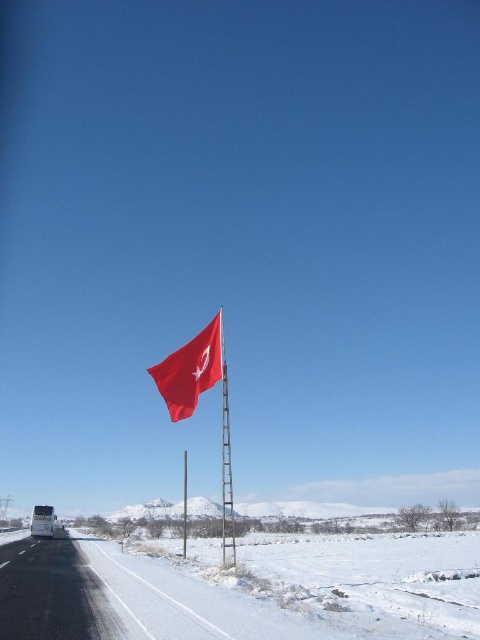
You are a driver approaching the intersection where the black asphalt highway at lower left and the metallic silver flag pole at center are visible. Which object is closer to your right side when looking forward?

The metallic silver flag pole at center is to the right of the black asphalt highway at lower left, so when approaching the intersection, the metallic silver flag pole at center would be on your right side.

You are standing in the winter landscape looking at the Turkish flag and the ladder. There are two points marked on the image. Which of these points, point 1 at coordinates point (x=54, y=612) or point 2 at coordinates point (x=224, y=401), is closer to you?

Point 1 at coordinates point (x=54, y=612) is closer to the viewer than point 2 at coordinates point (x=224, y=401).